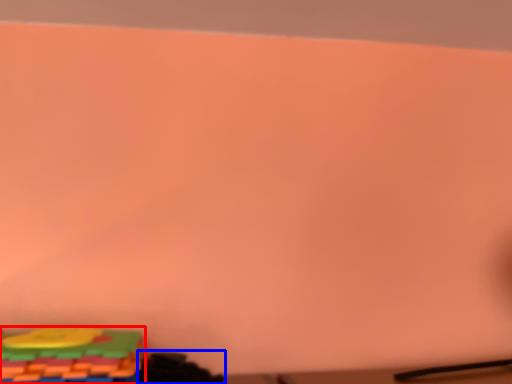
Question: Which point is closer to the camera, toy (highlighted by a red box) or toy (highlighted by a blue box)?

Choices:
 (A) toy
 (B) toy

Answer: (A)